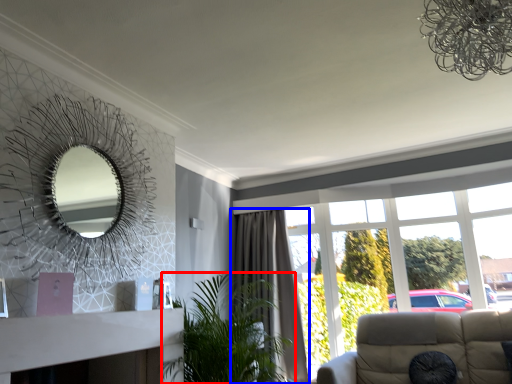
Question: Among these objects, which one is farthest to the camera, houseplant (highlighted by a red box) or curtain (highlighted by a blue box)?

Choices:
 (A) houseplant
 (B) curtain

Answer: (B)